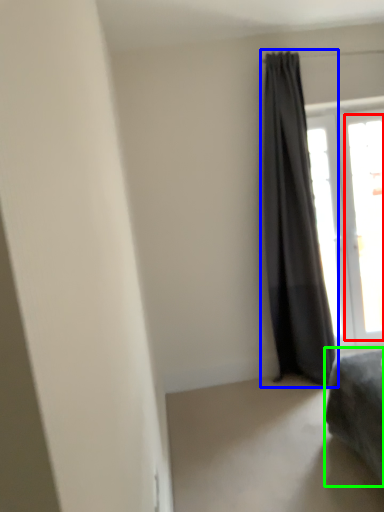
Question: Estimate the real-world distances between objects in this image. Which object is farther from window (highlighted by a red box), curtain (highlighted by a blue box) or furniture (highlighted by a green box)?

Choices:
 (A) curtain
 (B) furniture

Answer: (B)